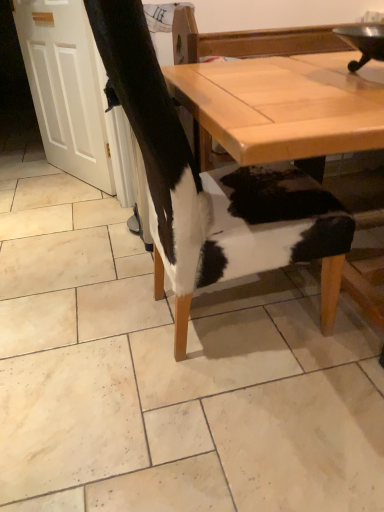
Identify the location of empty space that is ontop of cowhide chair at center (from a real-world perspective). (195, 313).